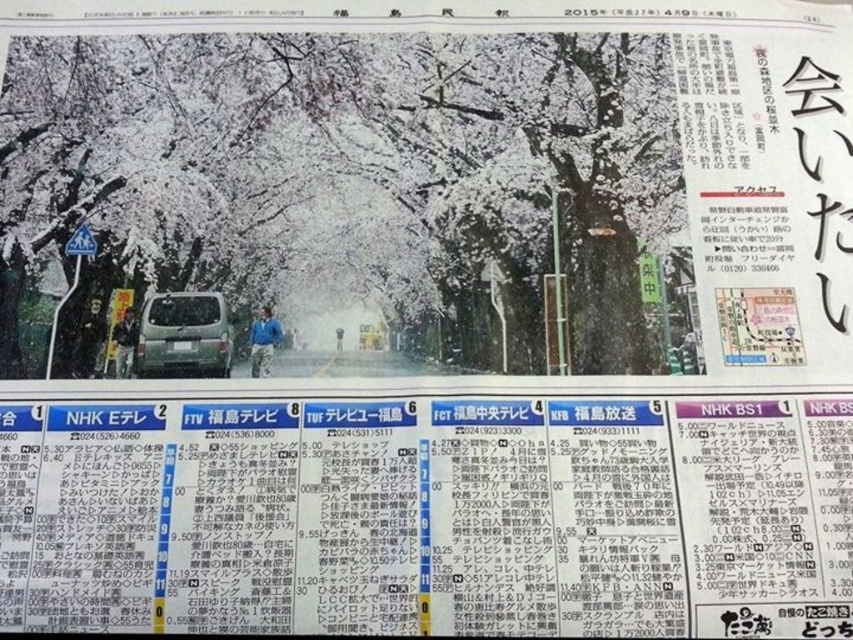
Does white paper at bottom have a larger size compared to matte silver van at center?

Yes.

Which is above, white paper at bottom or matte silver van at center?

matte silver van at center is higher up.

Between point (70, 625) and point (196, 324), which one is positioned behind?

The point (196, 324) is behind.

Where is `white paper at bottom`? white paper at bottom is located at coordinates (428, 515).